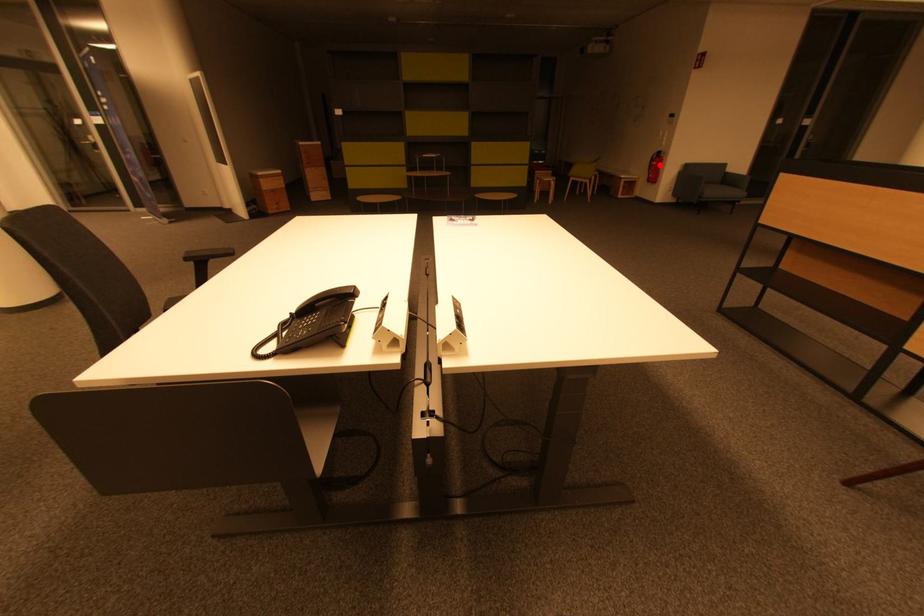
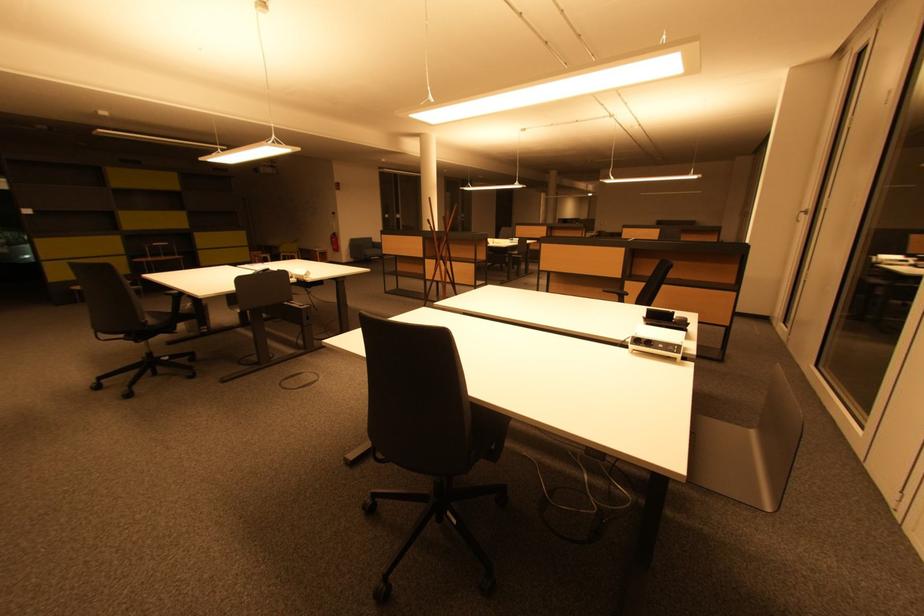
Where in the second image is the point corresponding to the highlighted location from the first image?

(338, 241)